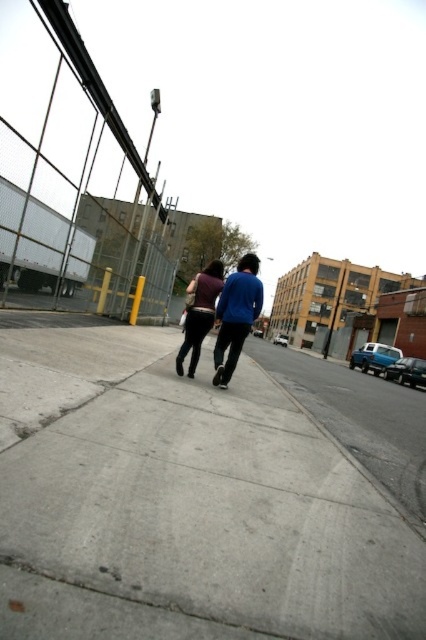
Does gray concrete sidewalk at center come behind matte blue jacket at center?

No, it is not.

What do you see at coordinates (183, 502) in the screenshot?
I see `gray concrete sidewalk at center` at bounding box center [183, 502].

This screenshot has height=640, width=426. Identify the location of gray concrete sidewalk at center. (183, 502).

Which of these two, matte blue jacket at center or matte purple shirt at center, stands taller?

Standing taller between the two is matte blue jacket at center.

The image size is (426, 640). What do you see at coordinates (236, 316) in the screenshot? I see `matte blue jacket at center` at bounding box center [236, 316].

You are a GUI agent. You are given a task and a screenshot of the screen. Output one action in this format:
    pyautogui.click(x=<x>, y=<y>)
    Task: Click on the matte blue jacket at center
    
    Given the screenshot: What is the action you would take?
    pyautogui.click(x=236, y=316)

Does gray concrete sidewalk at center lie in front of matte purple shirt at center?

Yes, it is in front of matte purple shirt at center.

Is gray concrete sidewalk at center taller than matte purple shirt at center?

Incorrect, gray concrete sidewalk at center's height is not larger of matte purple shirt at center's.

Find the location of `gray concrete sidewalk at center`. gray concrete sidewalk at center is located at coordinates (183, 502).

The height and width of the screenshot is (640, 426). Find the location of `gray concrete sidewalk at center`. gray concrete sidewalk at center is located at coordinates (183, 502).